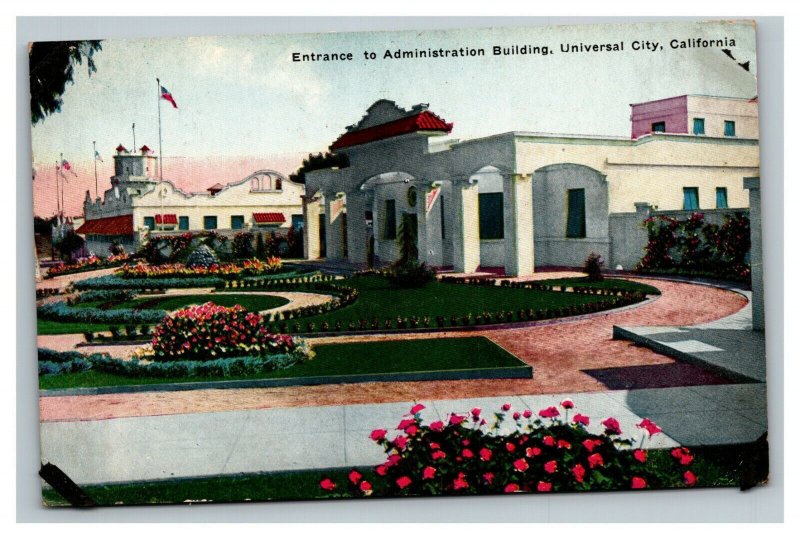
Identify the location of column. (526, 253), (469, 243), (428, 234), (305, 222), (326, 233), (353, 243).